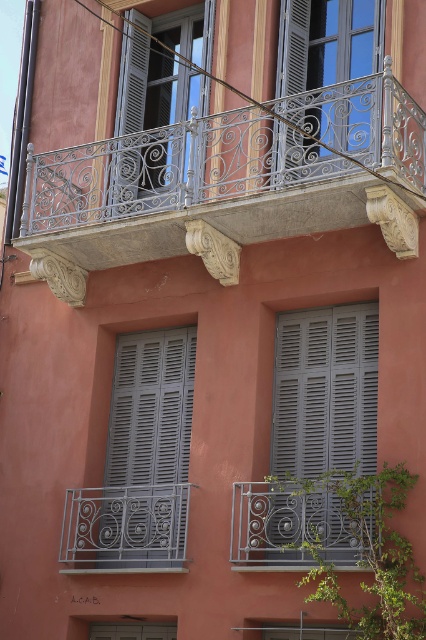
Question: Can you confirm if white wrought iron balcony at upper center is thinner than wrought iron balcony at lower center?

Choices:
 (A) no
 (B) yes

Answer: (A)

Question: Among these points, which one is farthest from the camera?

Choices:
 (A) (178, 536)
 (B) (163, 166)
 (C) (345, 525)
 (D) (180, 448)

Answer: (D)

Question: Estimate the real-world distances between objects in this image. Which object is farther from the matte gray metal window at upper center?

Choices:
 (A) matte gray window at upper center
 (B) gray matte shutters at center
 (C) wrought iron balcony at lower center

Answer: (C)

Question: Can you confirm if white wrought iron balcony at upper center is positioned to the left of matte gray metal window at upper center?

Choices:
 (A) yes
 (B) no

Answer: (A)

Question: Can you confirm if white wrought iron balcony at upper center is bigger than gray matte shutters at center?

Choices:
 (A) no
 (B) yes

Answer: (B)

Question: Which of these objects is positioned closest to the wrought iron balcony at lower center?

Choices:
 (A) matte gray window at upper center
 (B) gray matte shutters at center
 (C) dark gray wrought iron at center
 (D) gray matte shutter at center

Answer: (D)